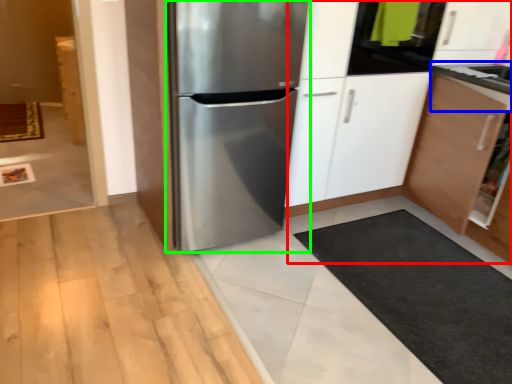
Question: Considering the real-world distances, which object is farthest from dresser (highlighted by a red box)? counter top (highlighted by a blue box) or refrigerator (highlighted by a green box)?

Choices:
 (A) counter top
 (B) refrigerator

Answer: (B)